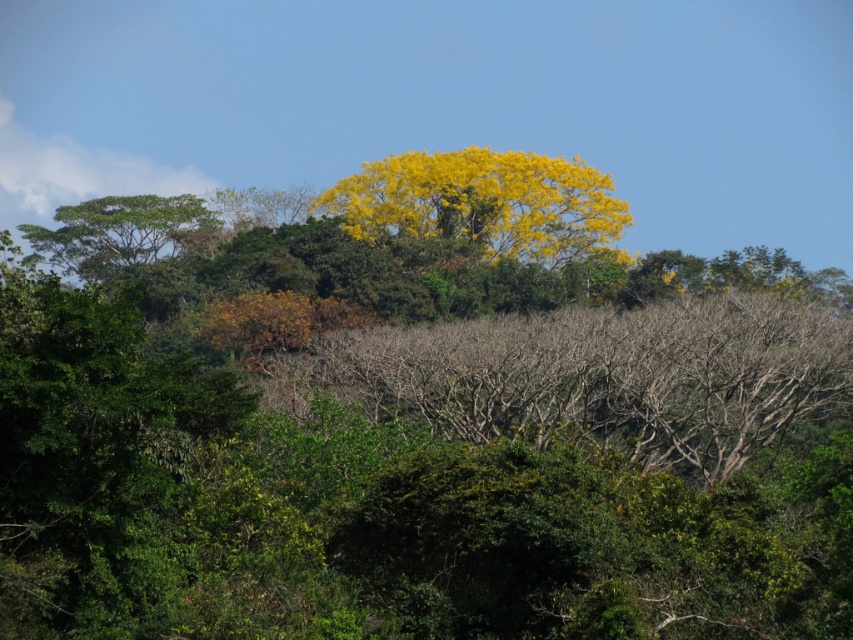
Question: Is yellow leafy tree at center below green leafy tree at left?

Choices:
 (A) no
 (B) yes

Answer: (A)

Question: Where is yellow leafy tree at center located in relation to green leafy tree at left in the image?

Choices:
 (A) above
 (B) below

Answer: (A)

Question: Which object is closer to the camera taking this photo?

Choices:
 (A) green leafy tree at left
 (B) yellow leafy tree at center

Answer: (B)

Question: In this image, where is yellow leafy tree at center located relative to green leafy tree at left?

Choices:
 (A) below
 (B) above

Answer: (B)